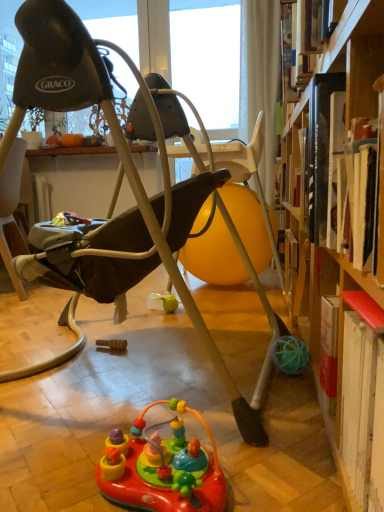
At what (x,y) coordinates should I click in order to perform the action: click on vacant area that is situated to the right of multicolored plastic toy at center. Please return your answer as a coordinate pair (x, y). This screenshot has height=512, width=384. Looking at the image, I should click on (280, 462).